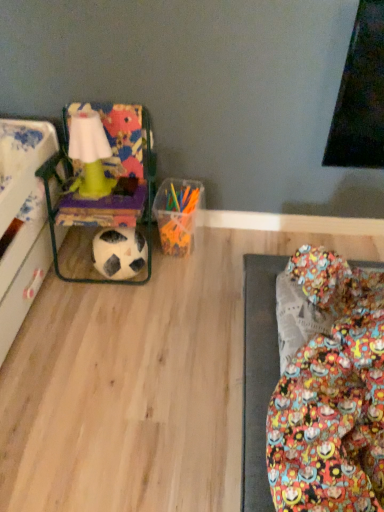
Question: Considering the positions of point pos(67,117) and point pos(135,248), is point pos(67,117) closer or farther from the camera than point pos(135,248)?

Choices:
 (A) closer
 (B) farther

Answer: (B)

Question: From their relative heights in the image, would you say multicolored fabric bean bag chair at left is taller or shorter than black matte football at lower left?

Choices:
 (A) short
 (B) tall

Answer: (B)

Question: Considering the positions of multicolored fabric bean bag chair at left and black matte football at lower left in the image, is multicolored fabric bean bag chair at left wider or thinner than black matte football at lower left?

Choices:
 (A) thin
 (B) wide

Answer: (B)

Question: Does point (125, 273) appear closer or farther from the camera than point (110, 156)?

Choices:
 (A) closer
 (B) farther

Answer: (B)

Question: Choose the correct answer: Is black matte football at lower left inside multicolored fabric bean bag chair at left or outside it?

Choices:
 (A) inside
 (B) outside

Answer: (A)

Question: Considering the positions of black matte football at lower left and multicolored fabric bean bag chair at left in the image, is black matte football at lower left wider or thinner than multicolored fabric bean bag chair at left?

Choices:
 (A) thin
 (B) wide

Answer: (A)

Question: Visually, is black matte football at lower left positioned to the left or to the right of multicolored fabric bean bag chair at left?

Choices:
 (A) right
 (B) left

Answer: (A)